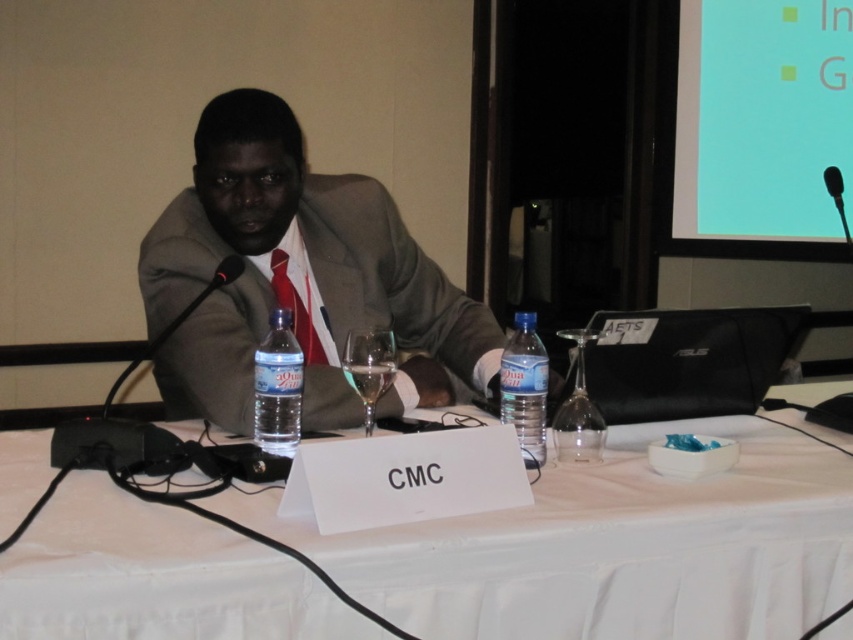
You are organizing a conference and need to ensure that all items on the table are visible to the camera positioned directly above the table. The red silk tie at center is blocking the view of the clear plastic water bottle at center. Is there a way to adjust their positions so that the water bottle is fully visible without moving the camera?

The clear plastic water bottle at center is bigger than the red silk tie at center, so moving the red silk tie slightly to the side would allow the larger water bottle to be fully visible under the camera without needing to move the camera itself.

You are attending a meeting and need to place a document on the table between the matte gray suit at center and the blue plastic bottle at center. Which object should you avoid placing the document too close to, considering their heights?

You should avoid placing the document too close to the matte gray suit at center because it has a greater height compared to the blue plastic bottle at center, which might cause the document to be obstructed or unstable.